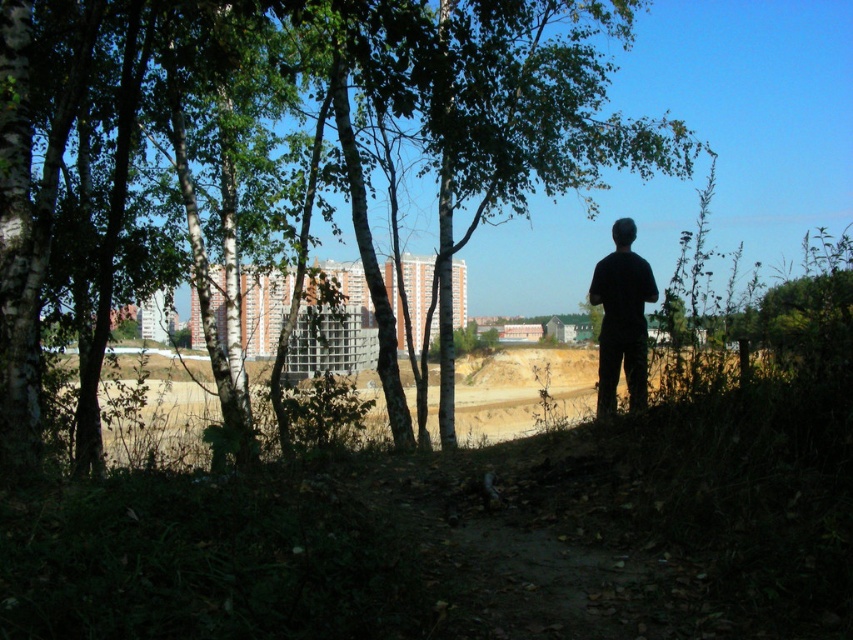
You are standing at the point marked by the coordinates point [428,116] in the image. Looking around, what object is located exactly at your current position?

The point [428,116] marks the green leafy tree at center.

You are a photographer trying to capture a photo of the green leafy tree at center and the black matte shirt at center. Since you want to ensure both are in focus, you need to know which object is taller. Can you tell me which one is taller?

The green leafy tree at center has a greater height compared to the black matte shirt at center, so the green leafy tree at center is taller.

From the picture: You are a photographer trying to capture the black matte shirt at center and the green leafy tree at center in the same frame. Based on their widths, which object would you need to position closer to the camera to ensure both fit within the frame?

The black matte shirt at center has a smaller width than the green leafy tree at center. To fit both in the frame, position the black matte shirt at center closer to the camera since it is narrower.